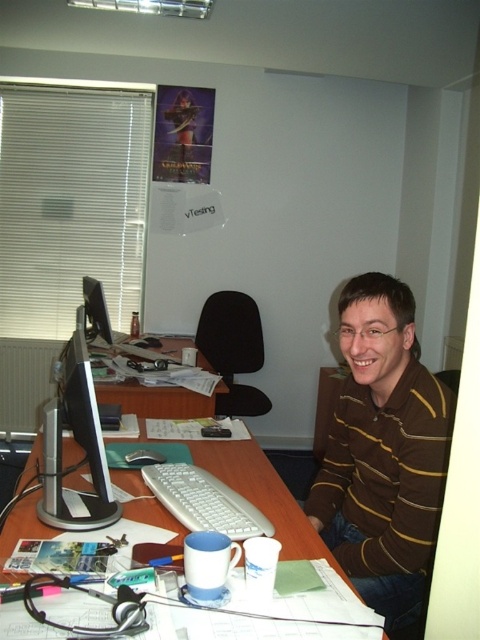
Is point (59, 476) more distant than point (265, 522)?

Yes.

Is satin silver monitor at center in front of white plastic keyboard at center?

Yes, satin silver monitor at center is closer to the viewer.

Find the location of a particular element. The image size is (480, 640). satin silver monitor at center is located at coordinates [79, 444].

Image resolution: width=480 pixels, height=640 pixels. What are the coordinates of `satin silver monitor at center` in the screenshot? It's located at (79, 444).

Consider the image. Between brown striped shirt at center and matte black monitor at left, which one appears on the left side from the viewer's perspective?

Positioned to the left is matte black monitor at left.

Which is in front, point (349, 512) or point (99, 282)?

Point (349, 512)

Identify the location of brown striped shirt at center. The height and width of the screenshot is (640, 480). (384, 452).

At what (x,y) coordinates should I click in order to perform the action: click on brown striped shirt at center. Please return your answer as a coordinate pair (x, y). The image size is (480, 640). Looking at the image, I should click on (384, 452).

In the scene shown: Can you confirm if white plastic monitor at center is positioned above matte black monitor at left?

Actually, white plastic monitor at center is below matte black monitor at left.

Does white plastic monitor at center lie behind matte black monitor at left?

That is False.

Between point (116, 394) and point (91, 296), which one is positioned in front?

Point (116, 394)

Where is `white plastic monitor at center`? Image resolution: width=480 pixels, height=640 pixels. white plastic monitor at center is located at coordinates (158, 400).